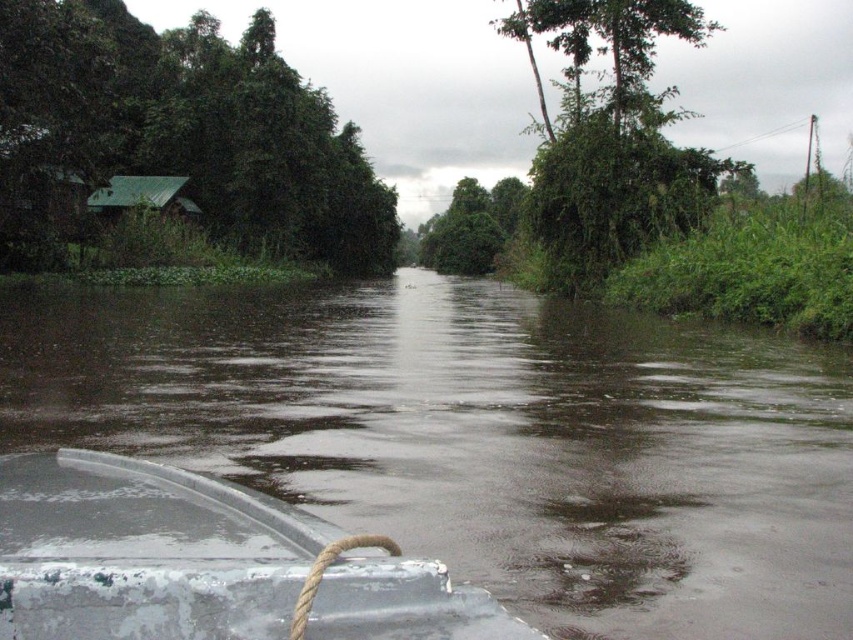
Question: Considering the relative positions of green matte roof at upper left and green leafy tree at upper center in the image provided, where is green matte roof at upper left located with respect to green leafy tree at upper center?

Choices:
 (A) below
 (B) above

Answer: (A)

Question: Which object is positioned farthest from the white matte boat at center?

Choices:
 (A) glossy dark water at center
 (B) green matte hut at left
 (C) green matte roof at upper left
 (D) green leafy tree at upper center

Answer: (B)

Question: Is green leafy tree at upper center positioned at the back of green matte hut at left?

Choices:
 (A) no
 (B) yes

Answer: (A)

Question: Considering the real-world distances, which object is closest to the green matte roof at upper left?

Choices:
 (A) green matte hut at left
 (B) glossy dark water at center
 (C) white matte boat at center

Answer: (A)

Question: Is green leafy tree at upper center behind green matte hut at left?

Choices:
 (A) yes
 (B) no

Answer: (B)

Question: Among these objects, which one is farthest from the camera?

Choices:
 (A) white matte boat at center
 (B) green matte hut at left
 (C) green leafy tree at upper center

Answer: (B)